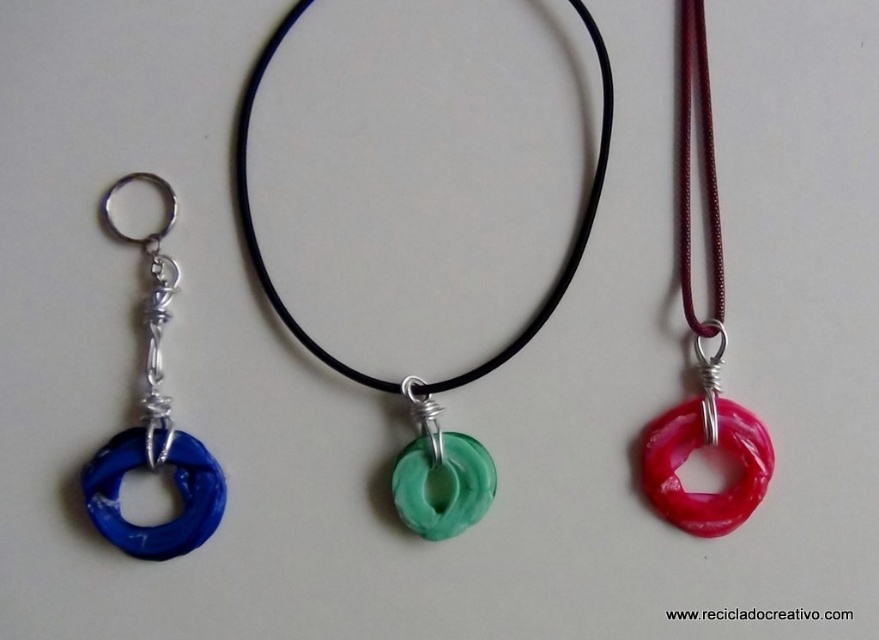
Is green translucent ring at center taller than blue plastic ring at left?

Indeed, green translucent ring at center has a greater height compared to blue plastic ring at left.

Does point (427, 534) lie in front of point (134, 461)?

No, (427, 534) is further to viewer.

The width and height of the screenshot is (879, 640). I want to click on green translucent ring at center, so click(x=415, y=376).

Identify the location of blue plastic ring at left. The image size is (879, 640). (153, 424).

Does blue plastic ring at left have a larger size compared to green rubbery ring at center?

→ Yes, blue plastic ring at left is bigger than green rubbery ring at center.

Who is more forward, (169, 209) or (473, 492)?

Point (169, 209)

Where is `blue plastic ring at left`? Image resolution: width=879 pixels, height=640 pixels. blue plastic ring at left is located at coordinates (153, 424).

How much distance is there between pink translucent ring at center and green translucent ring at center?

The distance of pink translucent ring at center from green translucent ring at center is 26.60 centimeters.

Does point (688, 268) come closer to viewer compared to point (245, 90)?

No, (688, 268) is behind (245, 90).

The height and width of the screenshot is (640, 879). What are the coordinates of `pink translucent ring at center` in the screenshot? It's located at (701, 346).